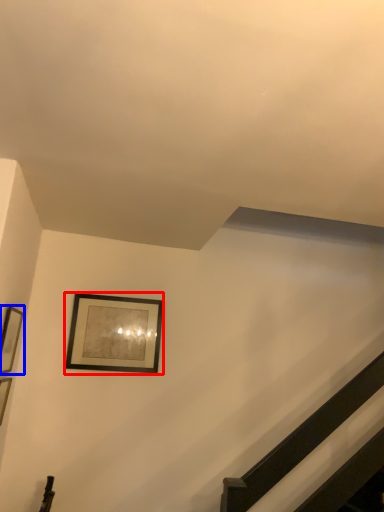
Question: Among these objects, which one is farthest to the camera, picture frame (highlighted by a red box) or picture frame (highlighted by a blue box)?

Choices:
 (A) picture frame
 (B) picture frame

Answer: (A)